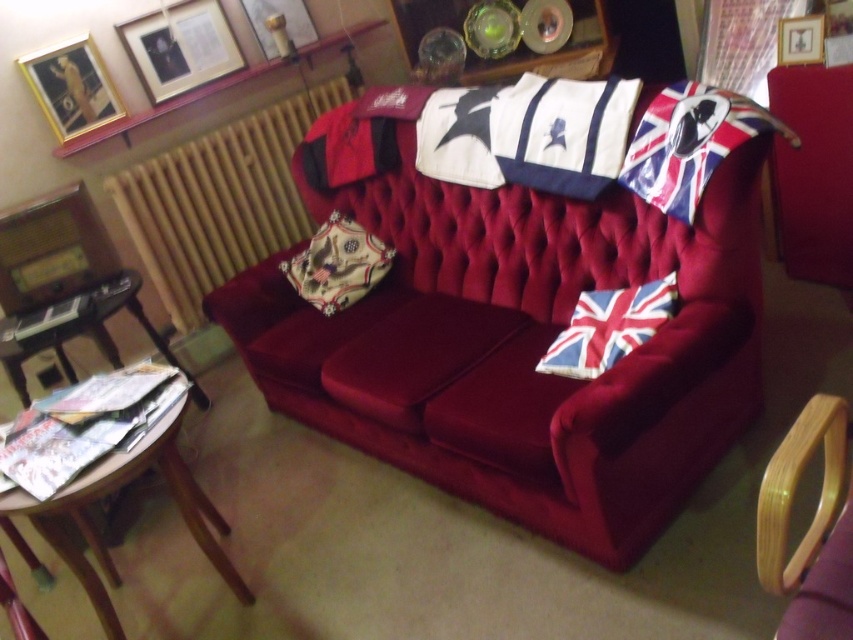
You are an interior designer assessing the placement of the gold metallic picture frame at upper left and the metallic gold picture frame at upper center. Which frame is positioned closer to the front of the living room?

The gold metallic picture frame at upper left is closer to the viewer than the metallic gold picture frame at upper center, so it is positioned closer to the front of the living room.